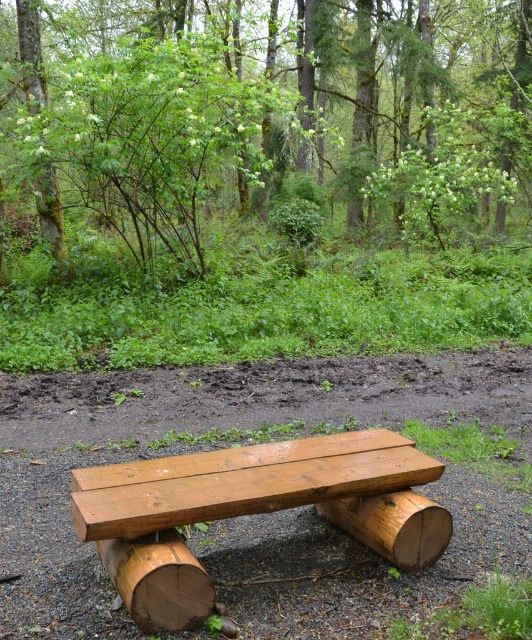
Question: Can you confirm if green leafy tree at upper center is positioned above natural wood bench at center?

Choices:
 (A) yes
 (B) no

Answer: (A)

Question: Which object is the farthest from the natural wood log at center?

Choices:
 (A) natural wood bench at center
 (B) green mossy tree trunk at upper left

Answer: (B)

Question: Considering the real-world distances, which object is closest to the natural wood bench at center?

Choices:
 (A) green leafy tree at upper center
 (B) green mossy tree trunk at upper left

Answer: (B)

Question: Is natural wood log at center below green mossy tree trunk at upper left?

Choices:
 (A) yes
 (B) no

Answer: (A)

Question: Where is natural wood bench at center located in relation to natural wood log at center in the image?

Choices:
 (A) right
 (B) left

Answer: (B)

Question: Estimate the real-world distances between objects in this image. Which object is farther from the natural wood log at center?

Choices:
 (A) green mossy tree trunk at upper left
 (B) natural wood bench at center
 (C) green leafy tree at upper center

Answer: (C)